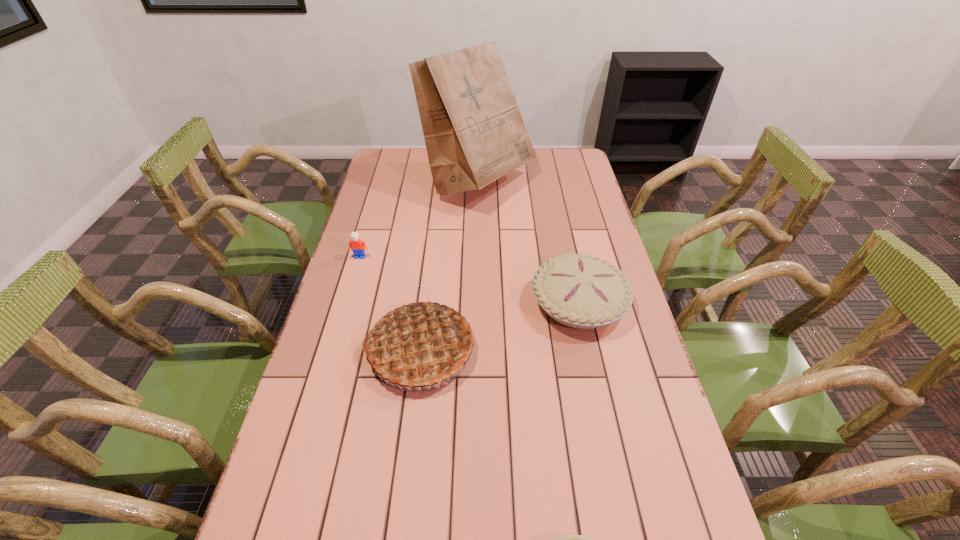
This screenshot has width=960, height=540. What are the coordinates of `free space between the second shortest pie and the second tallest object` in the screenshot? It's located at (499, 326).

In order to click on vacant area between the grocery bag and the tallest pie in this screenshot , I will do `click(449, 266)`.

Find the location of a particular element. The width and height of the screenshot is (960, 540). free space between the grocery bag and the leftmost pie is located at coordinates (449, 266).

The width and height of the screenshot is (960, 540). I want to click on object that is the second closest one to the tallest pie, so click(x=356, y=245).

Locate which object ranks fourth in proximity to the second farthest object. Please provide its 2D coordinates. Your answer should be formatted as a tuple, i.e. [(x, y)], where the tuple contains the x and y coordinates of a point satisfying the conditions above.

[(570, 539)]

Where is `the third closest pie to the farthest object`? This screenshot has height=540, width=960. the third closest pie to the farthest object is located at coordinates (570, 539).

Find the location of a particular element. The image size is (960, 540). the closest pie relative to the second farthest object is located at coordinates (420, 345).

This screenshot has height=540, width=960. I want to click on vacant space that satisfies the following two spatial constraints: 1. on the back side of the second tallest pie; 2. on the left side of the fourth shortest object, so click(425, 302).